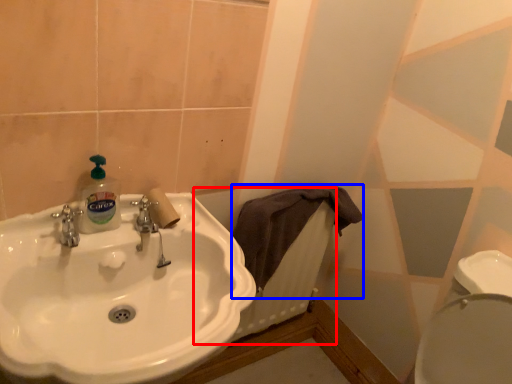
Question: Which point is further to the camera, radiator (highlighted by a red box) or bath towel (highlighted by a blue box)?

Choices:
 (A) radiator
 (B) bath towel

Answer: (A)